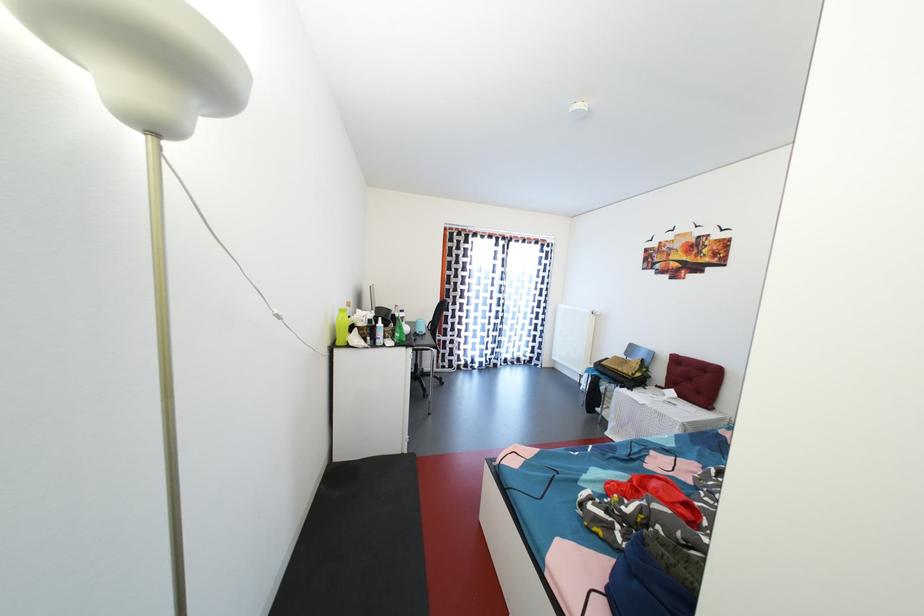
The location [694,379] corresponds to which object?

This point indicates the red tufted cushion.